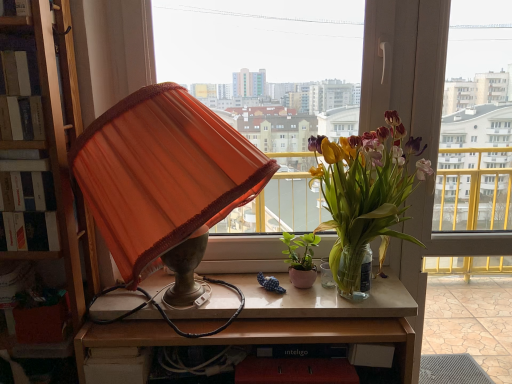
Where is `empty space that is ontop of wooden table at center (from a real-world perspective)`? The image size is (512, 384). empty space that is ontop of wooden table at center (from a real-world perspective) is located at coordinates (238, 321).